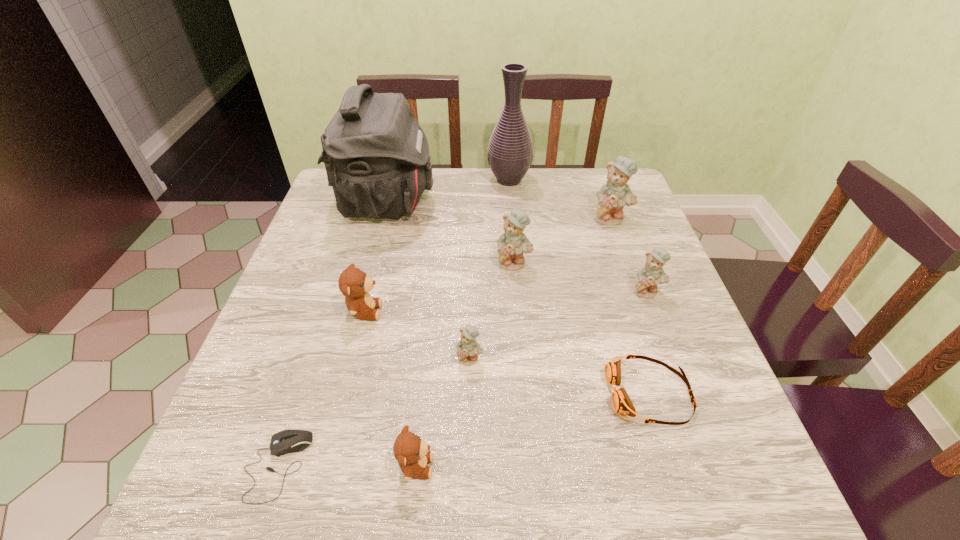
Where is `vase`? vase is located at coordinates (510, 151).

Identify the location of shoulder bag. (376, 155).

The height and width of the screenshot is (540, 960). What are the coordinates of `the biggest blue teddy bear` in the screenshot? It's located at [612, 197].

The width and height of the screenshot is (960, 540). I want to click on the farthest teddy bear, so click(612, 197).

The image size is (960, 540). Identify the location of the second farthest blue teddy bear. (512, 243).

Find the location of a particular element. The height and width of the screenshot is (540, 960). the fifth nearest teddy bear is located at coordinates (512, 243).

You are a GUI agent. You are given a task and a screenshot of the screen. Output one action in this format:
    pyautogui.click(x=<x>, y=<y>)
    Task: Click on the left brown teddy bear
    Image resolution: width=960 pixels, height=540 pixels.
    Given the screenshot: What is the action you would take?
    pyautogui.click(x=354, y=284)

Locate an element on the screen. This screenshot has width=960, height=540. the farther brown teddy bear is located at coordinates (354, 284).

You are a GUI agent. You are given a task and a screenshot of the screen. Output one action in this format:
    pyautogui.click(x=<x>, y=<y>)
    Task: Click on the second nearest blue teddy bear
    The height and width of the screenshot is (540, 960).
    Given the screenshot: What is the action you would take?
    pyautogui.click(x=651, y=275)

Image resolution: width=960 pixels, height=540 pixels. I want to click on the smallest blue teddy bear, so click(x=468, y=349).